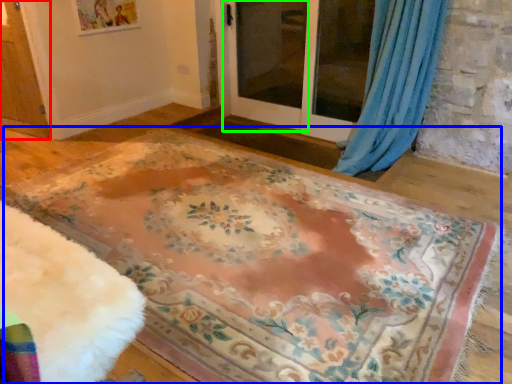
Question: Which object is positioned closest to screen door (highlighted by a red box)? Select from mat (highlighted by a blue box) and screen door (highlighted by a green box).

Choices:
 (A) mat
 (B) screen door

Answer: (A)